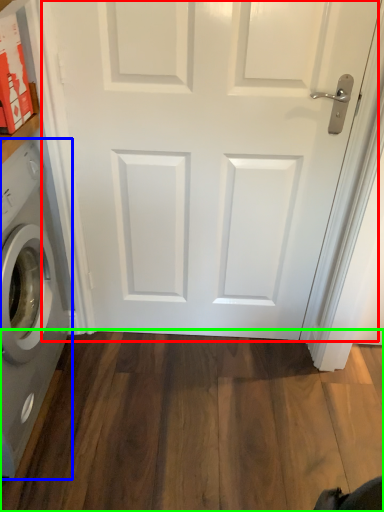
Question: Which is farther away from door (highlighted by a red box)? washing machine (highlighted by a blue box) or hardwood (highlighted by a green box)?

Choices:
 (A) washing machine
 (B) hardwood

Answer: (B)